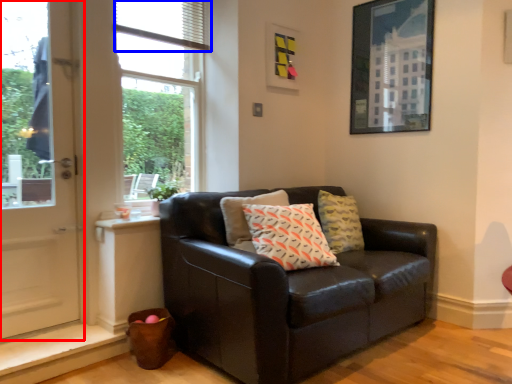
Question: Which object is further to the camera taking this photo, door (highlighted by a red box) or blind (highlighted by a blue box)?

Choices:
 (A) door
 (B) blind

Answer: (B)